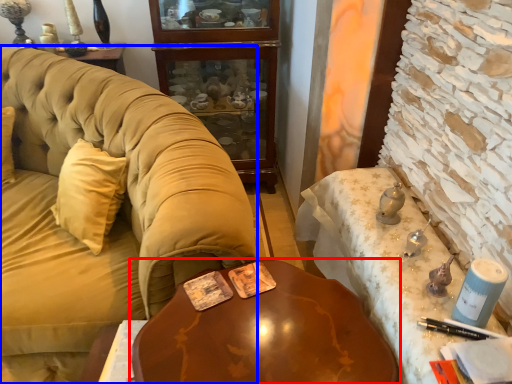
Question: Which object is further to the camera taking this photo, table (highlighted by a red box) or studio couch (highlighted by a blue box)?

Choices:
 (A) table
 (B) studio couch

Answer: (B)